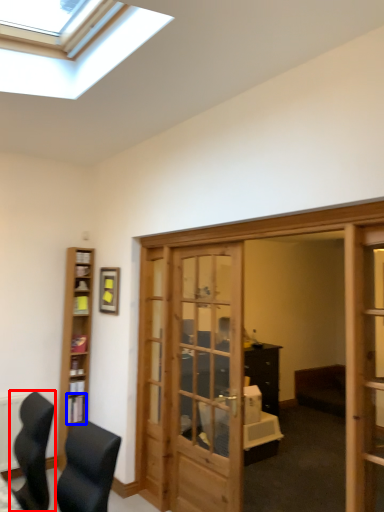
Question: Which point is closer to the camera, chair (highlighted by a red box) or shelf (highlighted by a blue box)?

Choices:
 (A) chair
 (B) shelf

Answer: (A)